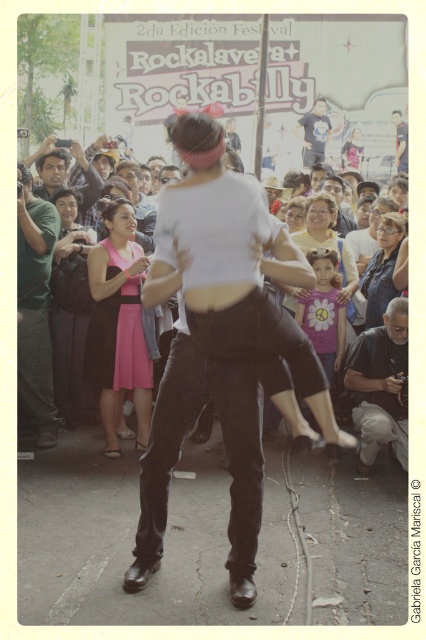
Question: Among these points, which one is farthest from the camera?

Choices:
 (A) (55, 244)
 (B) (399, 435)
 (C) (181, 256)
 (D) (51, 392)

Answer: (A)

Question: Does matte white shirt at center have a smaller size compared to green cotton shirt at left?

Choices:
 (A) yes
 (B) no

Answer: (B)

Question: Observing the image, what is the correct spatial positioning of matte black dress at left in reference to matte black camera at upper left?

Choices:
 (A) left
 (B) right

Answer: (B)

Question: Which of these objects is positioned farthest from the matte black dress at left?

Choices:
 (A) matte white shirt at center
 (B) matte pink dress at center
 (C) matte black camera at upper left

Answer: (B)

Question: Is matte black dress at left in front of matte black camera at upper left?

Choices:
 (A) no
 (B) yes

Answer: (B)

Question: Which object is positioned closest to the matte black camera at upper left?

Choices:
 (A) dark blue t-shirt at upper center
 (B) pink satin dress at center

Answer: (B)